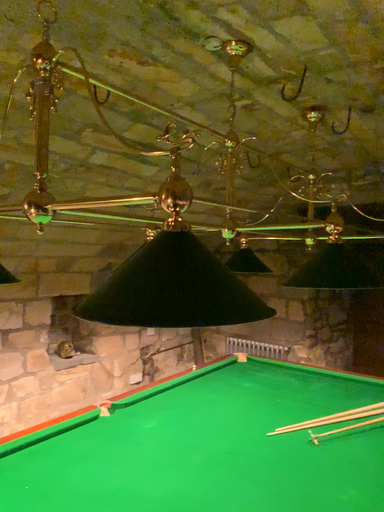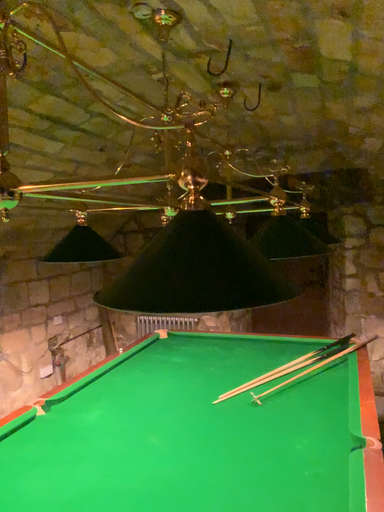
Question: How did the camera likely rotate when shooting the video?

Choices:
 (A) rotated right
 (B) rotated left

Answer: (A)